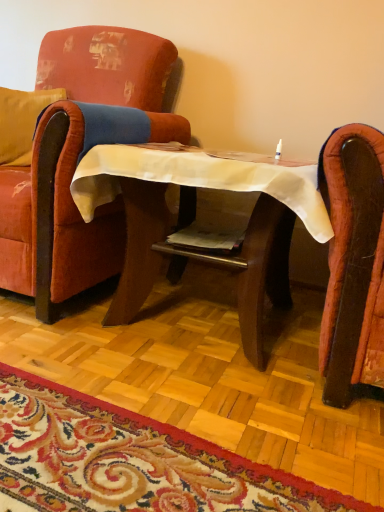
Find the location of a particular element. vacant space in front of wooden table at center is located at coordinates (169, 428).